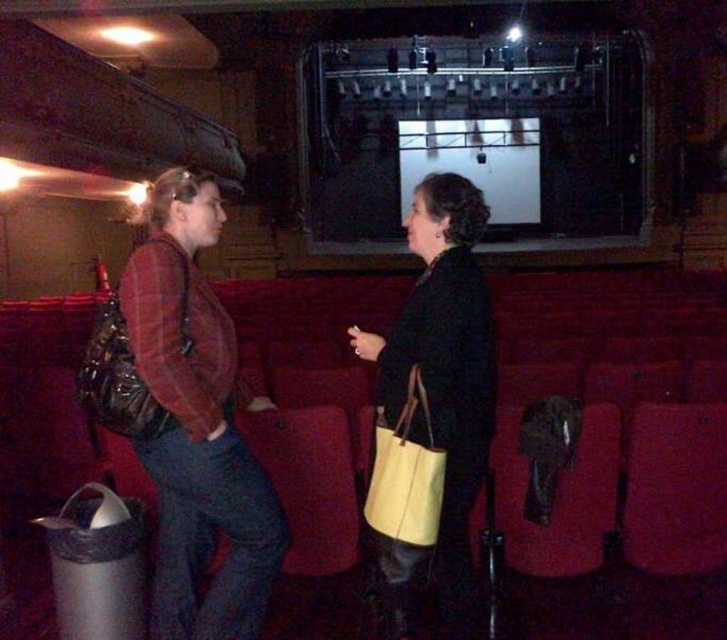
You are sitting in the theater and want to hand a program to both the plaid fabric jacket at left and the yellow fabric tote at center. Which person should you approach first to ensure you can reach them without moving from your seat?

You should approach the plaid fabric jacket at left first because it is closer to you than the yellow fabric tote at center, so you can reach them without moving from your seat.

You are an usher in a theater and need to determine which bag is taller between the matte yellow tote bag at center and the yellow fabric tote at center. Based on the scene description, which bag should you inform the theater security about?

The matte yellow tote bag at center is taller than the yellow fabric tote at center, so you should inform theater security about the matte yellow tote bag at center.